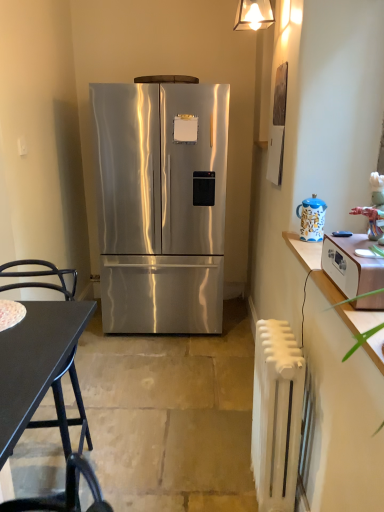
Question: Considering the relative sizes of blue ceramic teapot at right and black matte desk at lower left in the image provided, is blue ceramic teapot at right shorter than black matte desk at lower left?

Choices:
 (A) no
 (B) yes

Answer: (B)

Question: From the image's perspective, is blue ceramic teapot at right under black matte desk at lower left?

Choices:
 (A) no
 (B) yes

Answer: (A)

Question: Can you confirm if blue ceramic teapot at right is thinner than black matte desk at lower left?

Choices:
 (A) no
 (B) yes

Answer: (B)

Question: From the image's perspective, is blue ceramic teapot at right located above black matte desk at lower left?

Choices:
 (A) no
 (B) yes

Answer: (B)

Question: Is blue ceramic teapot at right directly adjacent to black matte desk at lower left?

Choices:
 (A) yes
 (B) no

Answer: (B)

Question: Is wooden toaster at right to the left or to the right of white wood cabinet at right in the image?

Choices:
 (A) right
 (B) left

Answer: (A)

Question: From a real-world perspective, is wooden toaster at right physically located above or below white wood cabinet at right?

Choices:
 (A) below
 (B) above

Answer: (A)

Question: From their relative heights in the image, would you say wooden toaster at right is taller or shorter than white wood cabinet at right?

Choices:
 (A) tall
 (B) short

Answer: (B)

Question: From the image's perspective, is wooden toaster at right positioned above or below white wood cabinet at right?

Choices:
 (A) above
 (B) below

Answer: (B)

Question: Based on their positions, is black matte desk at lower left located to the left or right of blue ceramic teapot at right?

Choices:
 (A) left
 (B) right

Answer: (A)

Question: From the image's perspective, is black matte desk at lower left above or below blue ceramic teapot at right?

Choices:
 (A) below
 (B) above

Answer: (A)

Question: From a real-world perspective, is black matte desk at lower left positioned above or below blue ceramic teapot at right?

Choices:
 (A) above
 (B) below

Answer: (B)

Question: Considering the positions of black matte desk at lower left and blue ceramic teapot at right in the image, is black matte desk at lower left bigger or smaller than blue ceramic teapot at right?

Choices:
 (A) small
 (B) big

Answer: (B)

Question: Would you say white wood cabinet at right is to the left or to the right of stainless steel refrigerator at center in the picture?

Choices:
 (A) right
 (B) left

Answer: (A)

Question: From a real-world perspective, is white wood cabinet at right above or below stainless steel refrigerator at center?

Choices:
 (A) above
 (B) below

Answer: (A)